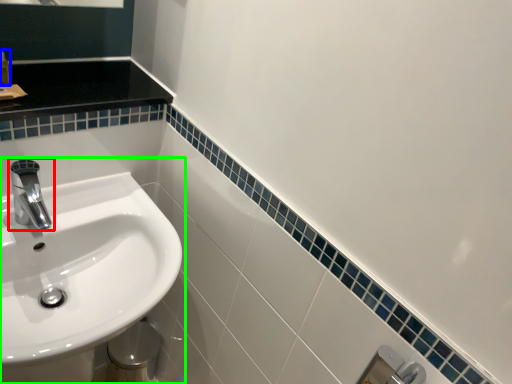
Question: Considering the real-world distances, which object is closest to tap (highlighted by a red box)? toiletry (highlighted by a blue box) or sink (highlighted by a green box).

Choices:
 (A) toiletry
 (B) sink

Answer: (B)